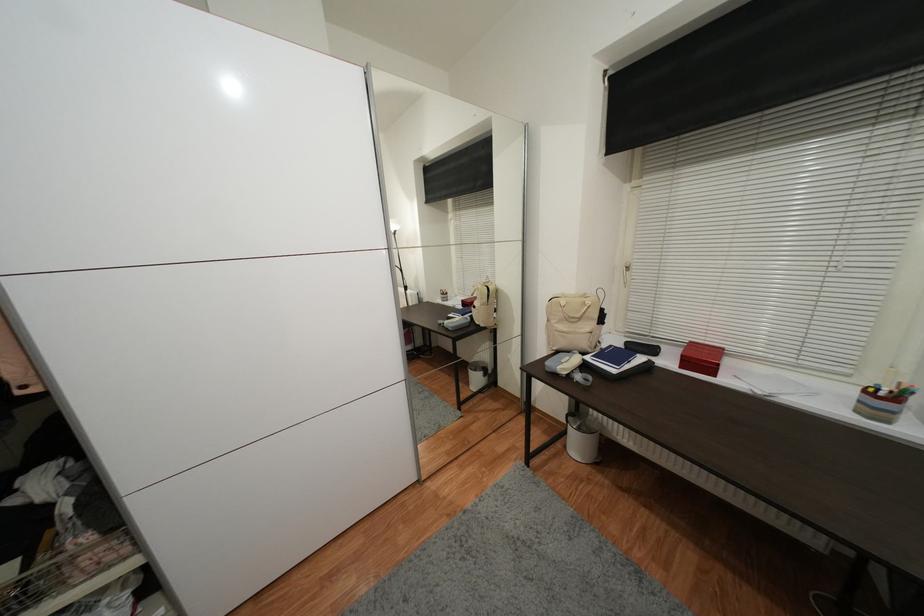
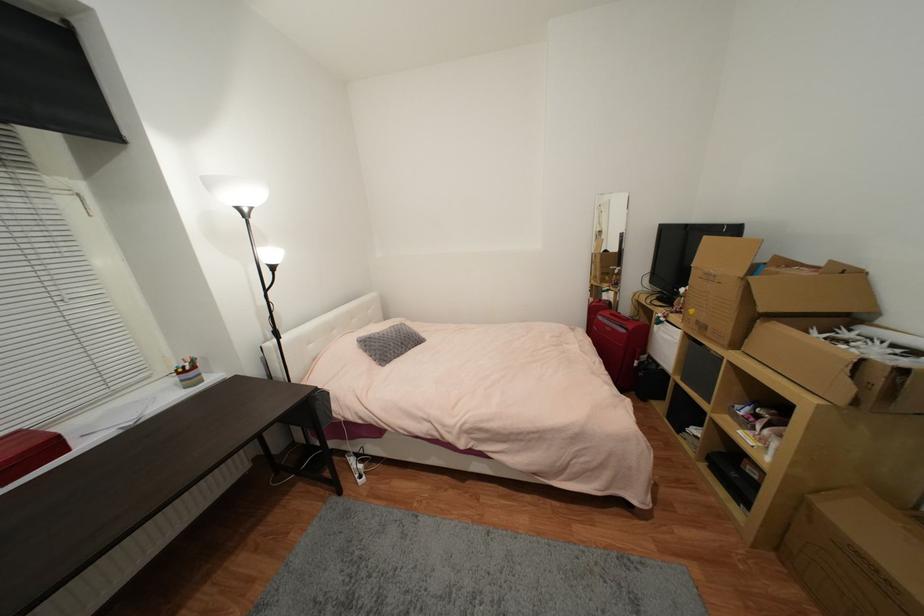
In the second image, find the point that corresponds to pixel 871 392 in the first image.

(185, 374)